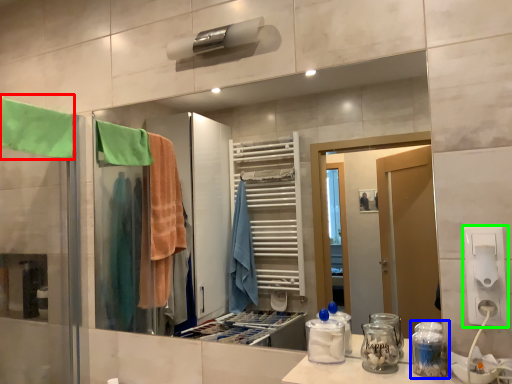
Question: Based on their relative distances, which object is farther from beach towel (highlighted by a red box)? Choose from glass jar (highlighted by a blue box) and electric outlet (highlighted by a green box).

Choices:
 (A) glass jar
 (B) electric outlet

Answer: (B)